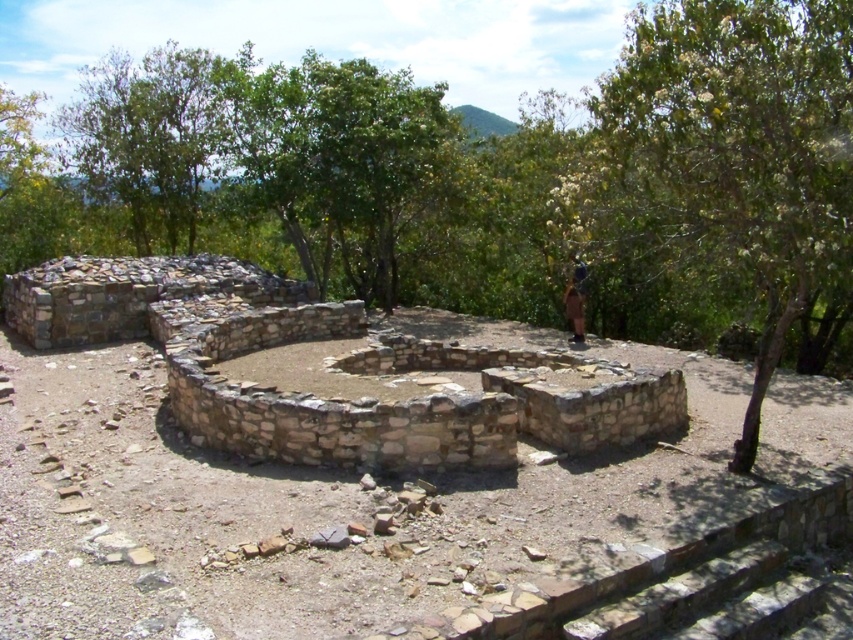
Question: Does green leafy tree at upper right have a larger size compared to brown fabric at center?

Choices:
 (A) no
 (B) yes

Answer: (B)

Question: Which point appears closest to the camera in this image?

Choices:
 (A) (641, 19)
 (B) (579, 289)

Answer: (B)

Question: Does green leafy tree at upper right appear on the left side of brown fabric at center?

Choices:
 (A) yes
 (B) no

Answer: (B)

Question: Is green leafy tree at upper right below brown fabric at center?

Choices:
 (A) no
 (B) yes

Answer: (A)